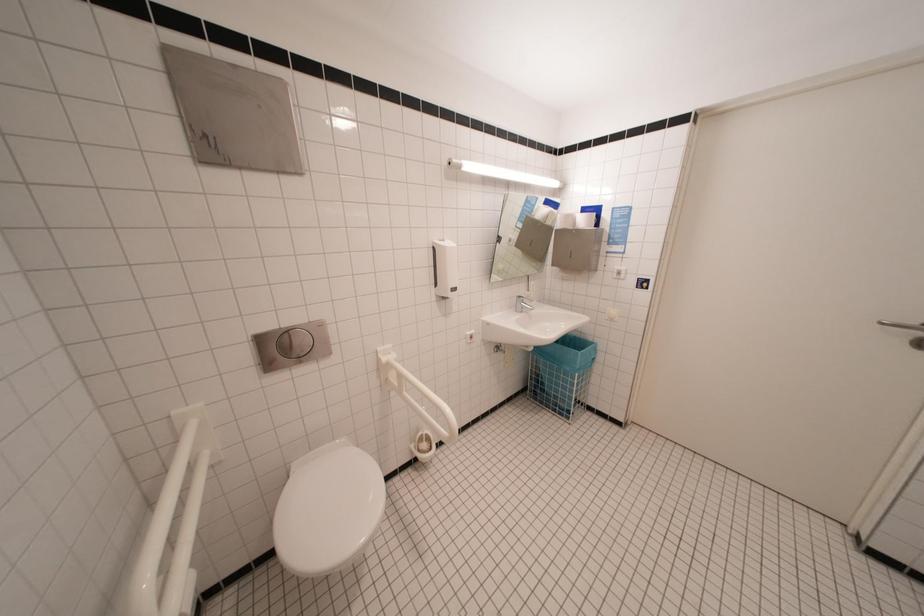
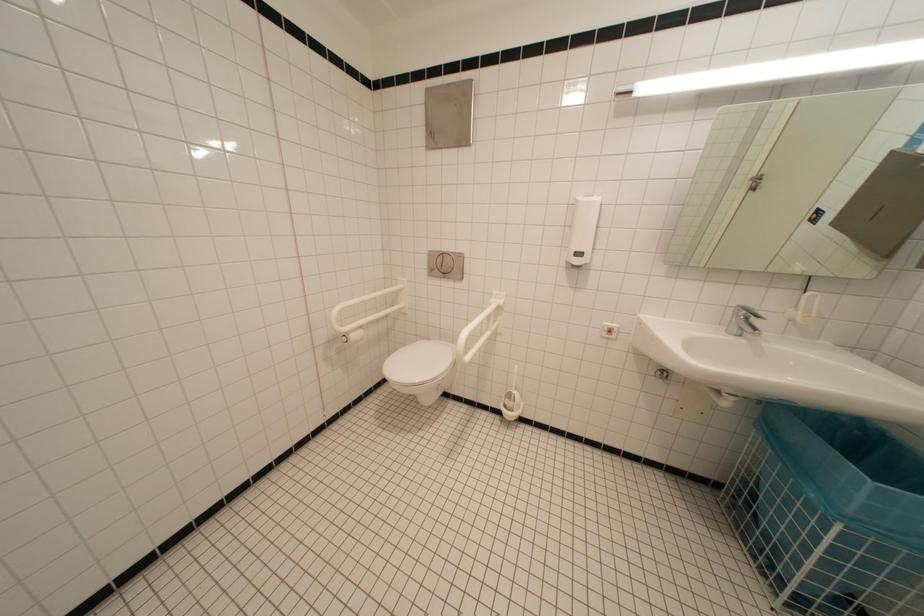
Question: How did the camera likely rotate?

Choices:
 (A) Left
 (B) Right
 (C) Up
 (D) Down

Answer: (A)